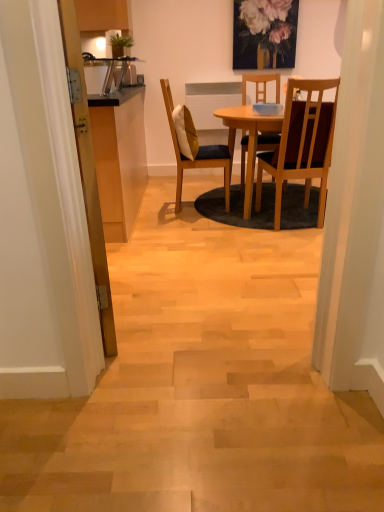
Question: In which direction should I rotate to look at brown wooden chair at center, which ranks as the first chair in right-to-left order?

Choices:
 (A) right
 (B) left

Answer: (A)

Question: Is wooden door at left next to yellow fabric pillow at center?

Choices:
 (A) yes
 (B) no

Answer: (B)

Question: Is wooden door at left to the left of yellow fabric pillow at center from the viewer's perspective?

Choices:
 (A) no
 (B) yes

Answer: (B)

Question: Considering the relative sizes of wooden door at left and yellow fabric pillow at center in the image provided, is wooden door at left taller than yellow fabric pillow at center?

Choices:
 (A) no
 (B) yes

Answer: (B)

Question: Is wooden door at left far from yellow fabric pillow at center?

Choices:
 (A) yes
 (B) no

Answer: (A)

Question: From the image's perspective, would you say wooden door at left is shown under yellow fabric pillow at center?

Choices:
 (A) no
 (B) yes

Answer: (B)

Question: Is yellow fabric pillow at center at the back of wooden door at left?

Choices:
 (A) yes
 (B) no

Answer: (B)

Question: Considering the relative positions of wooden chair with cushion at center, positioned as the second chair in right-to-left order, and brown wooden chair at center, marked as the second chair in a left-to-right arrangement, in the image provided, is wooden chair with cushion at center, positioned as the second chair in right-to-left order, to the right of brown wooden chair at center, marked as the second chair in a left-to-right arrangement, from the viewer's perspective?

Choices:
 (A) yes
 (B) no

Answer: (B)

Question: Is wooden chair with cushion at center, positioned as the second chair in right-to-left order, oriented towards brown wooden chair at center, marked as the second chair in a left-to-right arrangement?

Choices:
 (A) no
 (B) yes

Answer: (A)

Question: Considering the relative positions of wooden chair with cushion at center, the first chair when ordered from left to right, and brown wooden chair at center, which ranks as the first chair in right-to-left order, in the image provided, is wooden chair with cushion at center, the first chair when ordered from left to right, in front of brown wooden chair at center, which ranks as the first chair in right-to-left order,?

Choices:
 (A) yes
 (B) no

Answer: (B)

Question: Is wooden chair with cushion at center, positioned as the second chair in right-to-left order, placed right next to brown wooden chair at center, marked as the second chair in a left-to-right arrangement?

Choices:
 (A) yes
 (B) no

Answer: (B)

Question: From a real-world perspective, is wooden chair with cushion at center, the first chair when ordered from left to right, beneath brown wooden chair at center, marked as the second chair in a left-to-right arrangement?

Choices:
 (A) no
 (B) yes

Answer: (B)

Question: Is wooden chair with cushion at center, positioned as the second chair in right-to-left order, outside of brown wooden chair at center, marked as the second chair in a left-to-right arrangement?

Choices:
 (A) yes
 (B) no

Answer: (A)

Question: Is wooden chair with cushion at center, the first chair when ordered from left to right, bigger than yellow fabric pillow at center?

Choices:
 (A) no
 (B) yes

Answer: (B)